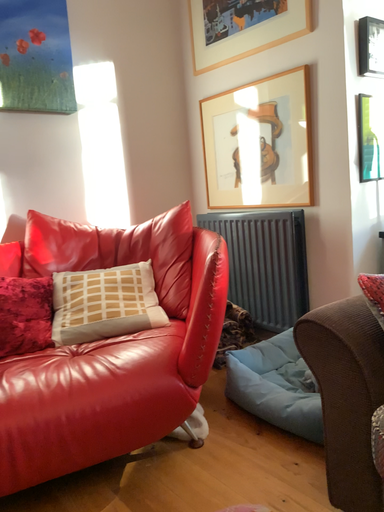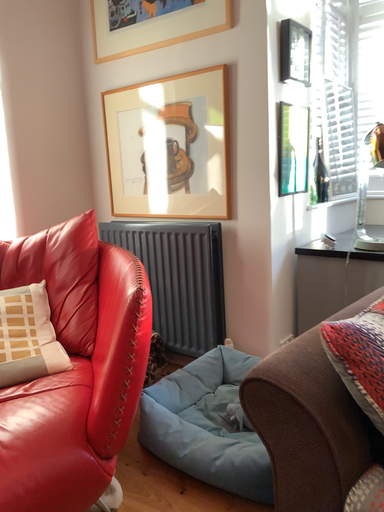
Question: How did the camera likely rotate when shooting the video?

Choices:
 (A) rotated left
 (B) rotated right

Answer: (B)